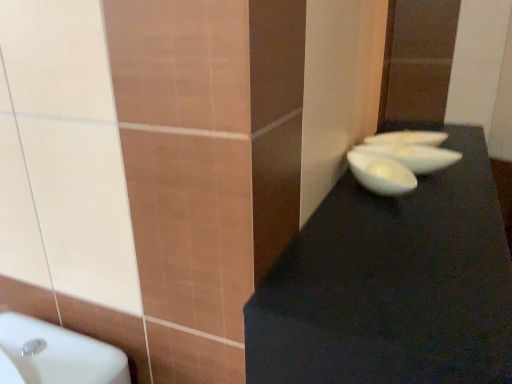
This screenshot has width=512, height=384. I want to click on free spot above black matte table at right (from a real-world perspective), so click(426, 208).